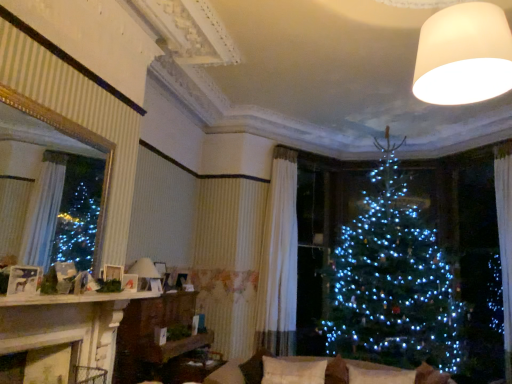
The height and width of the screenshot is (384, 512). In order to click on white textured curtain at center in this screenshot , I will do [x=279, y=259].

What are the coordinates of `matte white picture frame at left, the first picture frame in the top-to-bottom sequence` in the screenshot? It's located at (24, 280).

Measure the distance between point (302, 365) and camera.

Point (302, 365) and camera are 3.96 meters apart.

Describe the element at coordinates (293, 371) in the screenshot. The height and width of the screenshot is (384, 512). I see `white soft cushion at center, marked as the 1th pillow in a left-to-right arrangement` at that location.

This screenshot has height=384, width=512. What do you see at coordinates (379, 375) in the screenshot?
I see `white soft pillow at lower center, which appears as the first pillow when viewed from the right` at bounding box center [379, 375].

Where is `white soft pillow at lower center, which appears as the first pillow when viewed from the right`? white soft pillow at lower center, which appears as the first pillow when viewed from the right is located at coordinates (379, 375).

You are a GUI agent. You are given a task and a screenshot of the screen. Output one action in this format:
    pyautogui.click(x=<x>, y=<y>)
    Task: Click on the matte white picture frame at upper left, the 1th picture frame viewed from the back
    This screenshot has height=384, width=512.
    Given the screenshot: What is the action you would take?
    pyautogui.click(x=113, y=272)

Find the location of a particular element. The height and width of the screenshot is (384, 512). white textured curtain at center is located at coordinates (279, 259).

Considering the sizes of objects white soft pillow at lower center, acting as the 2th pillow starting from the left, and matte white lampshade at center, the 2th lamp in the front-to-back sequence, in the image provided, who is smaller, white soft pillow at lower center, acting as the 2th pillow starting from the left, or matte white lampshade at center, the 2th lamp in the front-to-back sequence,?

white soft pillow at lower center, acting as the 2th pillow starting from the left, is smaller.

Consider the image. How different are the orientations of white soft pillow at lower center, which appears as the first pillow when viewed from the right, and matte white lampshade at center, the 2th lamp in the front-to-back sequence, in degrees?

There is a 91.3-degree angle between the facing directions of white soft pillow at lower center, which appears as the first pillow when viewed from the right, and matte white lampshade at center, the 2th lamp in the front-to-back sequence.

In the image, is white soft pillow at lower center, acting as the 2th pillow starting from the left, on the left side or the right side of matte white lampshade at center, which appears as the 1th lamp when ordered from the bottom?

From the image, it's evident that white soft pillow at lower center, acting as the 2th pillow starting from the left, is to the right of matte white lampshade at center, which appears as the 1th lamp when ordered from the bottom.

Does point (368, 371) lie behind point (140, 262)?

That is False.

Can you confirm if matte white picture frame at upper left, which is the 2th picture frame from top to bottom, is shorter than wooden shelf at center?

Yes, matte white picture frame at upper left, which is the 2th picture frame from top to bottom, is shorter than wooden shelf at center.

From a real-world perspective, is matte white picture frame at upper left, which is the 2th picture frame from top to bottom, physically below wooden shelf at center?

Actually, matte white picture frame at upper left, which is the 2th picture frame from top to bottom, is physically above wooden shelf at center in the real world.

Is matte white picture frame at upper left, which ranks as the 2th picture frame in front-to-back order, inside the boundaries of wooden shelf at center, or outside?

matte white picture frame at upper left, which ranks as the 2th picture frame in front-to-back order, is not enclosed by wooden shelf at center.

Which object is further away from the camera, matte white picture frame at upper left, which is the 2th picture frame from top to bottom, or wooden shelf at center?

wooden shelf at center is behind.

Is wooden shelf at center situated inside beige fabric couch at lower center or outside?

wooden shelf at center is spatially situated outside beige fabric couch at lower center.

From a real-world perspective, is wooden shelf at center positioned above or below beige fabric couch at lower center?

From a real-world perspective, wooden shelf at center is physically above beige fabric couch at lower center.

From the image's perspective, is wooden shelf at center positioned above or below beige fabric couch at lower center?

From the image's perspective, wooden shelf at center appears below beige fabric couch at lower center.

Does white matte lampshade at upper right, the 2th lamp positioned from the back, turn towards white textured curtain at center?

No, white matte lampshade at upper right, the 2th lamp positioned from the back, does not turn towards white textured curtain at center.

Considering the positions of objects white matte lampshade at upper right, the 2th lamp positioned from the back, and white textured curtain at center in the image provided, who is more to the left, white matte lampshade at upper right, the 2th lamp positioned from the back, or white textured curtain at center?

white textured curtain at center.

Is white matte lampshade at upper right, acting as the first lamp starting from the right, positioned beyond the bounds of white textured curtain at center?

Yes.

Is point (451, 75) closer or farther from the camera than point (274, 190)?

Clearly, point (451, 75) is closer to the camera than point (274, 190).

How many degrees apart are the facing directions of white glossy mantel at lower left and white soft pillow at lower center, which appears as the first pillow when viewed from the right?

The angle between the facing direction of white glossy mantel at lower left and the facing direction of white soft pillow at lower center, which appears as the first pillow when viewed from the right, is 88.3 degrees.

From the image's perspective, which one is positioned lower, white glossy mantel at lower left or white soft pillow at lower center, which appears as the first pillow when viewed from the right?

white soft pillow at lower center, which appears as the first pillow when viewed from the right.

In the scene shown: Considering the relative sizes of white glossy mantel at lower left and white soft pillow at lower center, which appears as the first pillow when viewed from the right, in the image provided, is white glossy mantel at lower left smaller than white soft pillow at lower center, which appears as the first pillow when viewed from the right,?

Correct, white glossy mantel at lower left occupies less space than white soft pillow at lower center, which appears as the first pillow when viewed from the right.

Which is more to the left, white glossy mantel at lower left or white soft pillow at lower center, acting as the 2th pillow starting from the left?

white glossy mantel at lower left is more to the left.

Is beige fabric couch at lower center inside white soft pillow at lower center, acting as the 2th pillow starting from the left?

No.

In the scene shown: From a real-world perspective, which is physically above, white soft pillow at lower center, which appears as the first pillow when viewed from the right, or beige fabric couch at lower center?

white soft pillow at lower center, which appears as the first pillow when viewed from the right, from a real-world perspective.

You are a GUI agent. You are given a task and a screenshot of the screen. Output one action in this format:
    pyautogui.click(x=<x>, y=<y>)
    Task: Click on the couch located underneath the white soft pillow at lower center, which appears as the first pillow when viewed from the right (from a real-world perspective)
    
    Given the screenshot: What is the action you would take?
    pyautogui.click(x=253, y=369)

From the image's perspective, between beige fabric couch at lower center and white soft pillow at lower center, which appears as the first pillow when viewed from the right, who is located below?

beige fabric couch at lower center appears lower in the image.

Is beige fabric couch at lower center situated inside white soft pillow at lower center, acting as the 2th pillow starting from the left, or outside?

beige fabric couch at lower center is spatially situated outside white soft pillow at lower center, acting as the 2th pillow starting from the left.

Which of these two, beige fabric couch at lower center or white soft pillow at lower center, acting as the 2th pillow starting from the left, is thinner?

white soft pillow at lower center, acting as the 2th pillow starting from the left, is thinner.

Could you tell me if beige fabric couch at lower center is facing white soft pillow at lower center, which appears as the first pillow when viewed from the right?

Yes, beige fabric couch at lower center is turned towards white soft pillow at lower center, which appears as the first pillow when viewed from the right.

Find the location of a particular element. The width and height of the screenshot is (512, 384). the 1st pillow below the matte white lampshade at center, which is the 2th lamp in top-to-bottom order (from the image's perspective) is located at coordinates (379, 375).

Where is `picture frame that is the 1st object located in front of the wooden shelf at center`? The height and width of the screenshot is (384, 512). picture frame that is the 1st object located in front of the wooden shelf at center is located at coordinates [x=113, y=272].

When comparing their distances from matte white picture frame at left, the 2th picture frame positioned from the bottom, does white textured curtain at center or white soft pillow at lower center, which appears as the first pillow when viewed from the right, seem further?

Based on the image, white textured curtain at center appears to be further to matte white picture frame at left, the 2th picture frame positioned from the bottom.

Consider the image. From the image, which object appears to be nearer to matte white lampshade at center, the 1th lamp positioned from the back, white soft cushion at center, positioned as the 2th pillow in right-to-left order, or white matte lampshade at upper right, the 2th lamp positioned from the back?

white soft cushion at center, positioned as the 2th pillow in right-to-left order, is positioned closer to the anchor matte white lampshade at center, the 1th lamp positioned from the back.

Based on their spatial positions, is white soft cushion at center, marked as the 1th pillow in a left-to-right arrangement, or wooden shelf at center further from white matte lampshade at upper right, the first lamp positioned from the front?

Based on the image, wooden shelf at center appears to be further to white matte lampshade at upper right, the first lamp positioned from the front.

When comparing their distances from gold-framed mirror at left, does white matte lampshade at upper right, acting as the 2th lamp starting from the bottom, or beige fabric couch at lower center seem further?

white matte lampshade at upper right, acting as the 2th lamp starting from the bottom.

From the picture: Based on their spatial positions, is gold-framed mirror at left or white matte lampshade at upper right, positioned as the second lamp in left-to-right order, closer to white soft pillow at lower center, which appears as the first pillow when viewed from the right?

Among the two, white matte lampshade at upper right, positioned as the second lamp in left-to-right order, is located nearer to white soft pillow at lower center, which appears as the first pillow when viewed from the right.

From the picture: From the image, which object appears to be farther from wooden shelf at center, white textured curtain at center or matte white picture frame at left, the 2th picture frame positioned from the bottom?

Based on the image, matte white picture frame at left, the 2th picture frame positioned from the bottom, appears to be further to wooden shelf at center.

When comparing their distances from wooden shelf at center, does matte white picture frame at upper left, which is the 2th picture frame from top to bottom, or matte white lampshade at center, the first lamp viewed from the left, seem further?

The object further to wooden shelf at center is matte white picture frame at upper left, which is the 2th picture frame from top to bottom.

Which object lies further to the anchor point white glossy mantel at lower left, gold-framed mirror at left or white matte lampshade at upper right, acting as the first lamp starting from the right?

white matte lampshade at upper right, acting as the first lamp starting from the right, is further to white glossy mantel at lower left.

Locate an element on the screen. Image resolution: width=512 pixels, height=384 pixels. mantle between white matte lampshade at upper right, the 2th lamp positioned from the back, and wooden shelf at center in the up-down direction is located at coordinates (73, 298).

Locate an element on the screen. The image size is (512, 384). couch located between matte white picture frame at left, the first picture frame in the top-to-bottom sequence, and white soft pillow at lower center, acting as the 2th pillow starting from the left, in the left-right direction is located at coordinates (253, 369).

The image size is (512, 384). I want to click on lamp located between gold-framed mirror at left and white matte lampshade at upper right, acting as the first lamp starting from the right, in the left-right direction, so click(144, 269).

Where is `window screen positioned between white glossy mantel at lower left and matte white lampshade at center, the 2th lamp in the front-to-back sequence, from near to far`? window screen positioned between white glossy mantel at lower left and matte white lampshade at center, the 2th lamp in the front-to-back sequence, from near to far is located at coordinates coord(71,137).